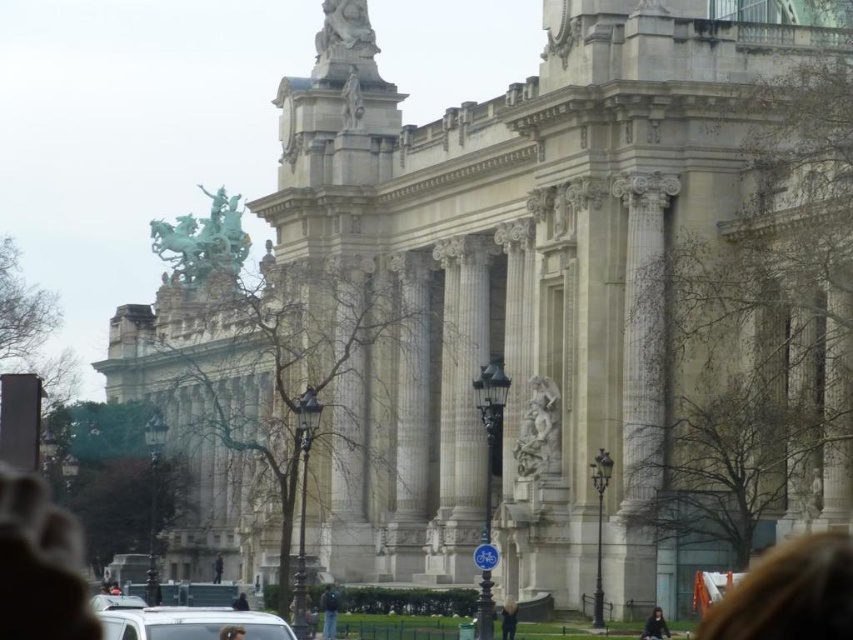
From the picture: Does white marble statue at upper center appear on the left side of black fabric person at lower center?

No, white marble statue at upper center is not to the left of black fabric person at lower center.

Who is higher up, white marble statue at upper center or black fabric person at lower center?

Positioned higher is white marble statue at upper center.

Image resolution: width=853 pixels, height=640 pixels. What do you see at coordinates (352, 100) in the screenshot?
I see `white marble statue at upper center` at bounding box center [352, 100].

Locate an element on the screen. white marble statue at upper center is located at coordinates (352, 100).

This screenshot has width=853, height=640. I want to click on white marble column at center, so click(641, 381).

Can you confirm if white marble column at center is smaller than blonde hair at lower right?

Actually, white marble column at center might be larger than blonde hair at lower right.

Where is `white marble column at center`? Image resolution: width=853 pixels, height=640 pixels. white marble column at center is located at coordinates (641, 381).

Can you confirm if white matte car at lower center is positioned above black fabric person at lower center?

Correct, white matte car at lower center is located above black fabric person at lower center.

Consider the image. Between white matte car at lower center and black fabric person at lower center, which one is positioned higher?

white matte car at lower center is higher up.

Where is `white matte car at lower center`? white matte car at lower center is located at coordinates (115, 602).